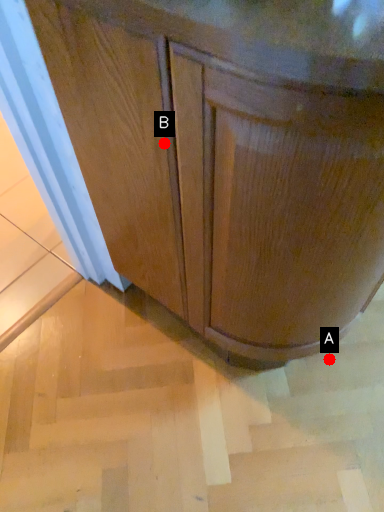
Question: Two points are circled on the image, labeled by A and B beside each circle. Which point is farther to the camera?

Choices:
 (A) A is further
 (B) B is further

Answer: (A)